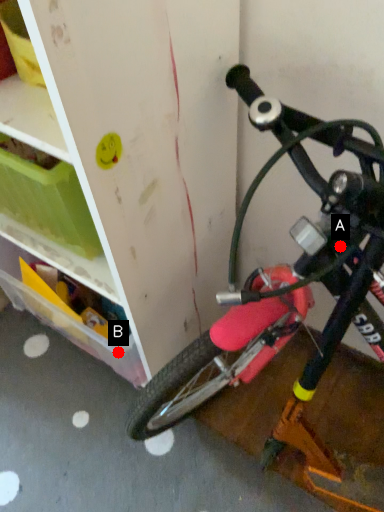
Question: Two points are circled on the image, labeled by A and B beside each circle. Which point is farther from the camera taking this photo?

Choices:
 (A) A is further
 (B) B is further

Answer: (B)